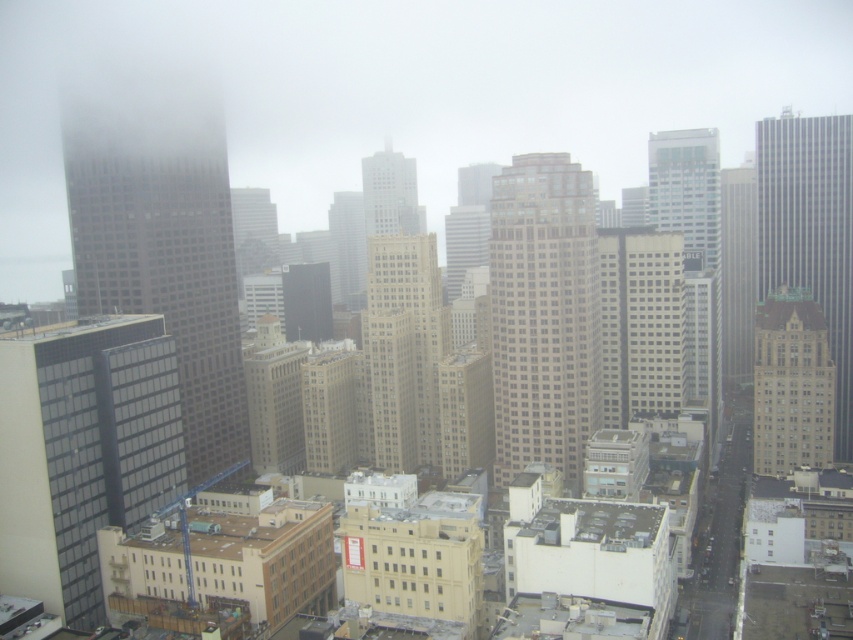
You are standing on the observation deck of a nearby building and want to take a photo of both the beige stone building at center and the gray concrete skyscraper at center. The camera you have can focus on objects within a 100 meter range. Will both buildings be in focus?

The beige stone building at center is 80.09 meters from the gray concrete skyscraper at center. Since the camera can focus on objects within 100 meters, both buildings will be within the focus range and thus in focus.

Looking at this image, you are standing on a balcony overlooking the city and notice two points in the distance. One is labeled as point (387, 237) and the other as point (825, 380). Which point appears closer to you?

Point (387, 237) is further to the camera than point (825, 380), so the latter appears closer to you.